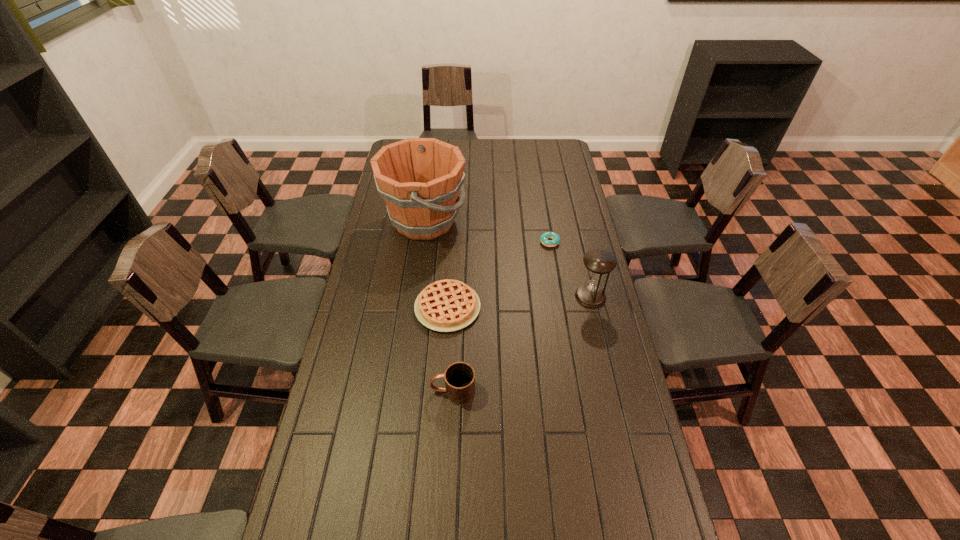
This screenshot has width=960, height=540. Find the location of `blank space located on the side of the third tallest object with the handle`. blank space located on the side of the third tallest object with the handle is located at coordinates (373, 391).

Where is `vacant position located on the side of the third tallest object with the handle`? vacant position located on the side of the third tallest object with the handle is located at coordinates (397, 391).

The image size is (960, 540). I want to click on free spot located on the side of the third tallest object with the handle, so click(357, 391).

Find the location of a particular element. The height and width of the screenshot is (540, 960). vacant space situated 0.180m on the front of the fourth tallest object is located at coordinates tap(443, 382).

Where is `free space located 0.250m on the back of the doughnut`? The image size is (960, 540). free space located 0.250m on the back of the doughnut is located at coordinates (542, 200).

Find the location of a particular element. Image resolution: width=960 pixels, height=540 pixels. object present at the left edge is located at coordinates click(420, 179).

Where is `hourglass that is positioned at the right edge`? Image resolution: width=960 pixels, height=540 pixels. hourglass that is positioned at the right edge is located at coordinates (598, 262).

Locate an element on the screen. doughnut at the right edge is located at coordinates (545, 236).

In the image, there is a desktop. Where is `free space at the left edge`? free space at the left edge is located at coordinates (372, 242).

Locate an element on the screen. free space at the right edge of the desktop is located at coordinates (548, 176).